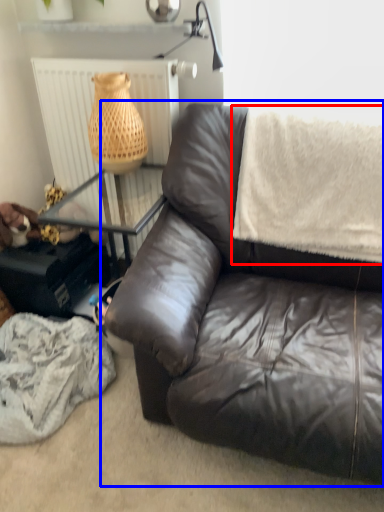
Question: Which point is further to the camera, blanket (highlighted by a red box) or studio couch (highlighted by a blue box)?

Choices:
 (A) blanket
 (B) studio couch

Answer: (A)